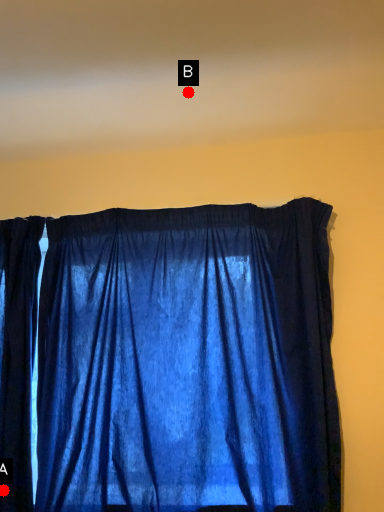
Question: Two points are circled on the image, labeled by A and B beside each circle. Which of the following is the closest to the observer?

Choices:
 (A) A is closer
 (B) B is closer

Answer: (A)